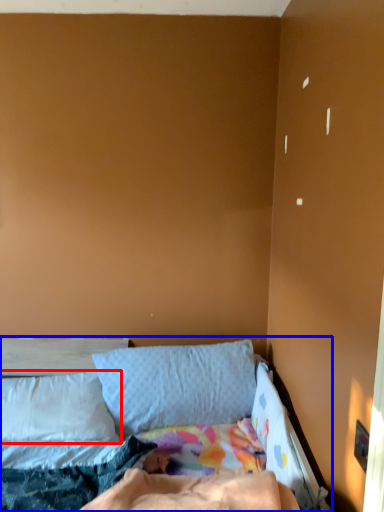
Question: Which point is further to the camera, pillow (highlighted by a red box) or bed (highlighted by a blue box)?

Choices:
 (A) pillow
 (B) bed

Answer: (A)